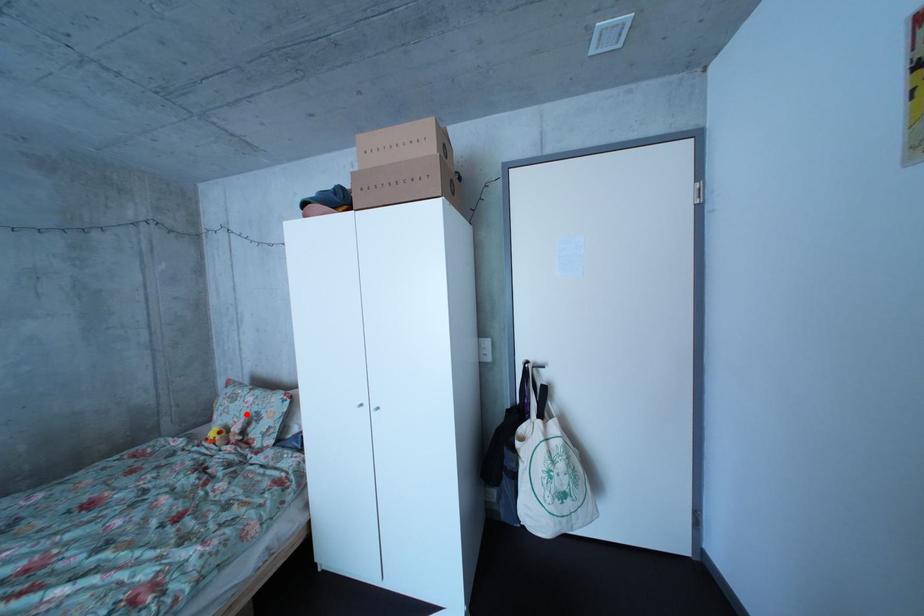
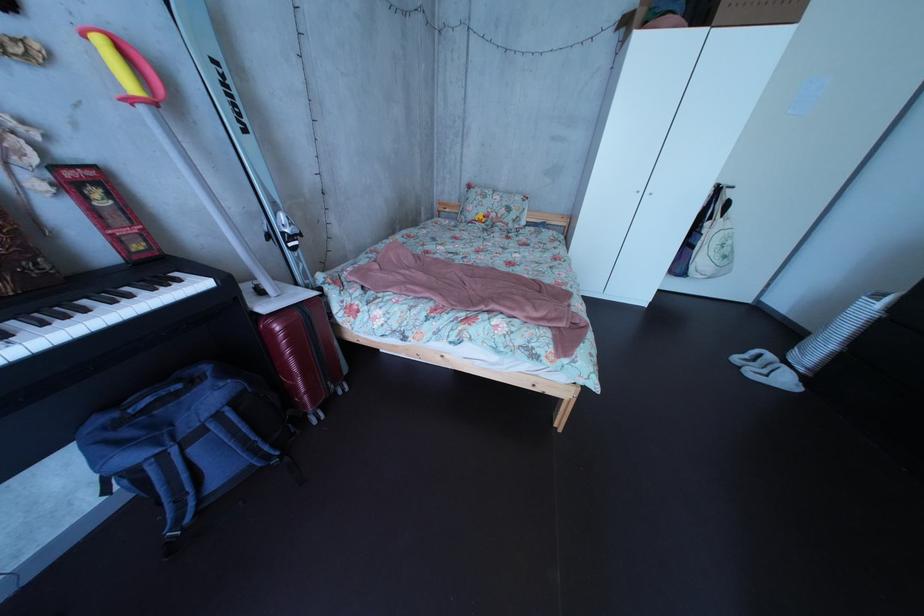
In the second image, find the point that corresponds to the highlighted location in the first image.

(499, 209)